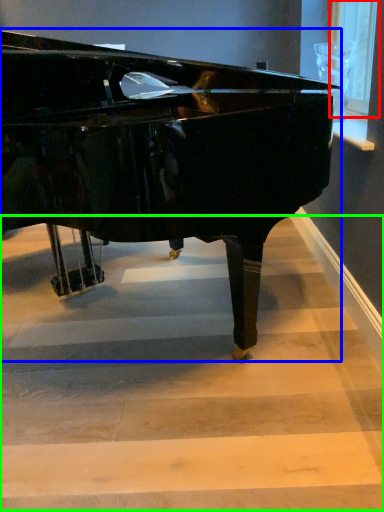
Question: Considering the real-world distances, which object is closest to window screen (highlighted by a red box)? piano (highlighted by a blue box) or stairwell (highlighted by a green box).

Choices:
 (A) piano
 (B) stairwell

Answer: (A)